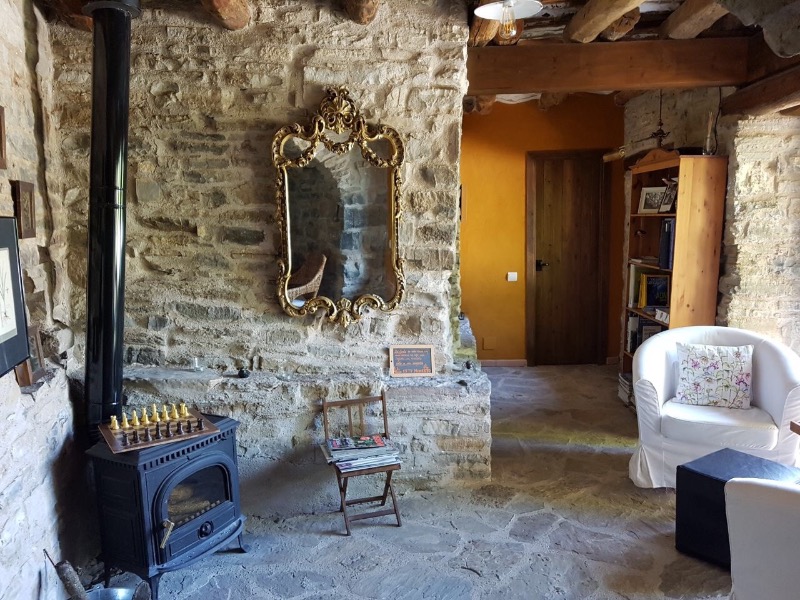
At what (x,y) coordinates should I click in order to perform the action: click on gilded frame. Please return your answer as a coordinate pair (x, y). Looking at the image, I should click on (344, 120).